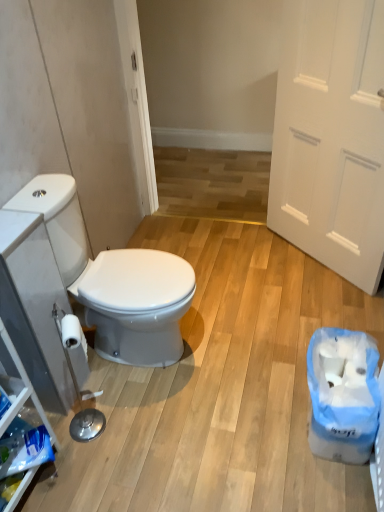
Identify the location of free space to the left of white matte door at right. (250, 268).